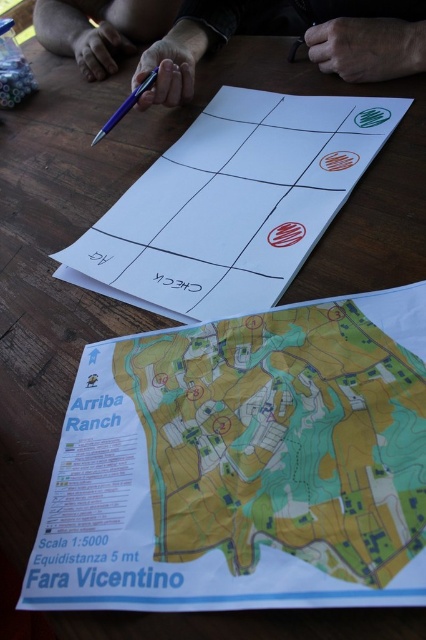
Between point (249, 484) and point (132, 32), which one is positioned in front?

Point (249, 484) is in front.

Can you confirm if green paper map at center is bigger than matte purple pen at upper center?

No, green paper map at center is not bigger than matte purple pen at upper center.

Describe the element at coordinates (282, 440) in the screenshot. I see `green paper map at center` at that location.

Where is `green paper map at center`? Image resolution: width=426 pixels, height=640 pixels. green paper map at center is located at coordinates (282, 440).

Which is below, matte purple pen at upper center or metallic purple pen at center?

metallic purple pen at center

The image size is (426, 640). I want to click on matte purple pen at upper center, so click(100, 29).

The image size is (426, 640). What do you see at coordinates (100, 29) in the screenshot? I see `matte purple pen at upper center` at bounding box center [100, 29].

Find the location of a particular element. The height and width of the screenshot is (640, 426). matte purple pen at upper center is located at coordinates (100, 29).

Consider the image. Between white paper at center and metallic purple pen at center, which one is positioned lower?

white paper at center is below.

Can you confirm if white paper at center is positioned to the right of metallic purple pen at center?

Correct, you'll find white paper at center to the right of metallic purple pen at center.

Is point (229, 307) closer to camera compared to point (126, 104)?

Yes, it is in front of point (126, 104).

Image resolution: width=426 pixels, height=640 pixels. I want to click on white paper at center, so click(x=232, y=204).